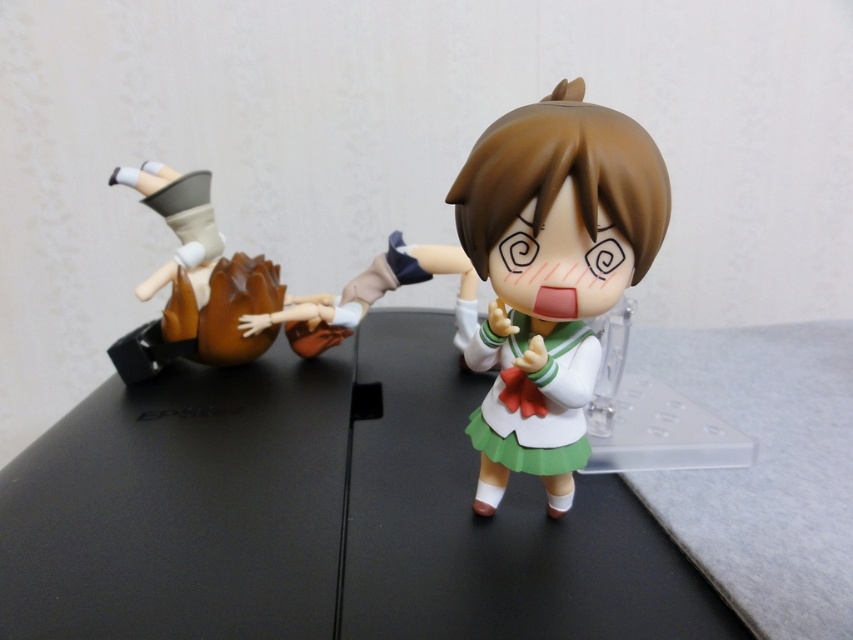
Question: Which object is farther from the camera taking this photo?

Choices:
 (A) black plastic table at center
 (B) satin white doll at center
 (C) brown matte/wooden figurine at left

Answer: (C)

Question: Does black plastic table at center have a greater width compared to brown matte/wooden figurine at left?

Choices:
 (A) yes
 (B) no

Answer: (A)

Question: Estimate the real-world distances between objects in this image. Which object is closer to the brown matte/wooden figurine at left?

Choices:
 (A) black plastic table at center
 (B) satin white doll at center

Answer: (A)

Question: Is black plastic table at center wider than satin white doll at center?

Choices:
 (A) yes
 (B) no

Answer: (A)

Question: Does black plastic table at center have a greater width compared to satin white doll at center?

Choices:
 (A) yes
 (B) no

Answer: (A)

Question: Which of these objects is positioned farthest from the brown matte/wooden figurine at left?

Choices:
 (A) black plastic table at center
 (B) satin white doll at center

Answer: (B)